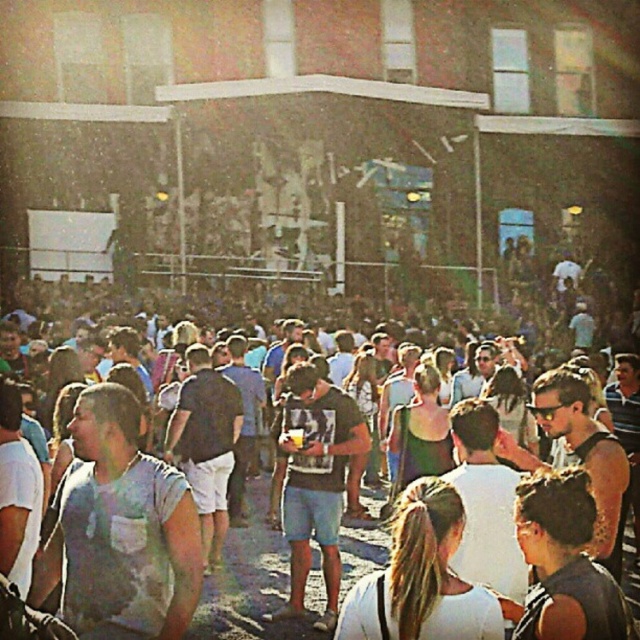
Can you confirm if dark brown t-shirt at center is wider than light blue denim shorts at center?

In fact, dark brown t-shirt at center might be narrower than light blue denim shorts at center.

Is point (337, 529) positioned in front of point (314, 563)?

Yes, point (337, 529) is closer to viewer.

This screenshot has height=640, width=640. I want to click on dark brown t-shirt at center, so click(x=316, y=481).

Is white matte shirt at center thinner than dark brown t-shirt at center?

No.

The image size is (640, 640). What are the coordinates of `white matte shirt at center` in the screenshot? It's located at (420, 577).

What do you see at coordinates (420, 577) in the screenshot? The height and width of the screenshot is (640, 640). I see `white matte shirt at center` at bounding box center [420, 577].

At what (x,y) coordinates should I click in order to perform the action: click on white matte shirt at center. Please return your answer as a coordinate pair (x, y). The image size is (640, 640). Looking at the image, I should click on (420, 577).

Does light blue cotton shirt at center appear on the left side of light blue denim shorts at center?

Yes, light blue cotton shirt at center is to the left of light blue denim shorts at center.

Consider the image. Is light blue cotton shirt at center taller than light blue denim shorts at center?

In fact, light blue cotton shirt at center may be shorter than light blue denim shorts at center.

Who is more distant from viewer, (80, 408) or (240, 532)?

The point (240, 532) is behind.

Identify the location of light blue cotton shirt at center. (120, 531).